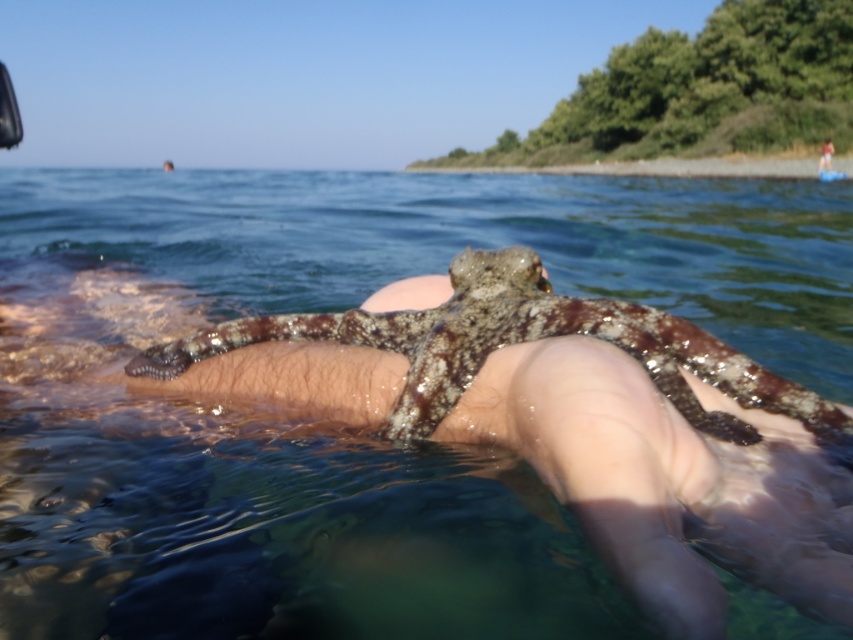
Question: Can you confirm if clear water at legs upper is smaller than smooth skin at upper center?

Choices:
 (A) no
 (B) yes

Answer: (A)

Question: Which point is farther to the camera?

Choices:
 (A) smooth skin at upper center
 (B) speckled skin octopus at center

Answer: (A)

Question: Which object is farther from the camera taking this photo?

Choices:
 (A) smooth skin at upper center
 (B) clear water at legs upper

Answer: (A)

Question: Can you confirm if speckled skin octopus at center is bigger than smooth skin at upper center?

Choices:
 (A) no
 (B) yes

Answer: (A)

Question: Among these objects, which one is farthest from the camera?

Choices:
 (A) clear water at legs upper
 (B) smooth skin at upper center

Answer: (B)

Question: Does clear water at legs upper lie behind speckled skin octopus at center?

Choices:
 (A) no
 (B) yes

Answer: (A)